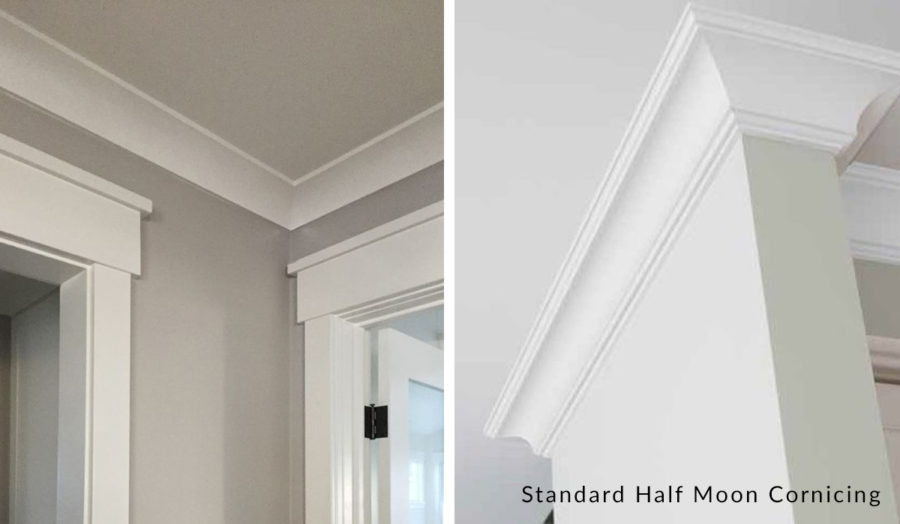
This screenshot has width=900, height=524. I want to click on ceiling, so click(x=293, y=108).